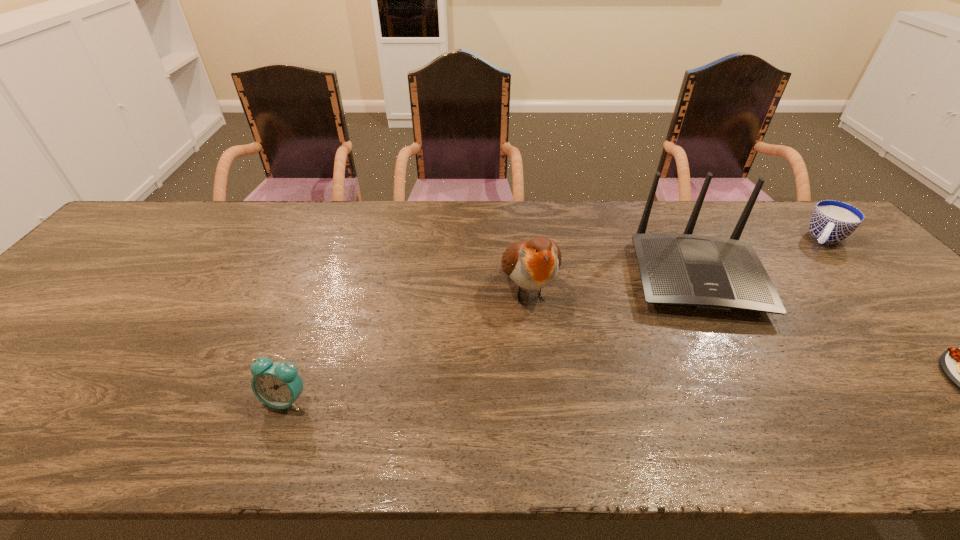
At what (x,y) coordinates should I click in order to perform the action: click on vacant space on the desktop that is between the third shortest object and the shortest object and is positioned on the front-facing side of the third object from right to left. Please return your answer as a coordinate pair (x, y). The image size is (960, 540). Looking at the image, I should click on (734, 389).

At what (x,y) coordinates should I click in order to perform the action: click on free spot on the desktop that is between the alarm clock and the sandwich and is positioned at the face of the second object from left to right. Please return your answer as a coordinate pair (x, y). The height and width of the screenshot is (540, 960). Looking at the image, I should click on (563, 393).

Identify the location of vacant space on the desktop that is between the third tallest object and the shortest object and is positioned on the side of the cup with the handle. (738, 388).